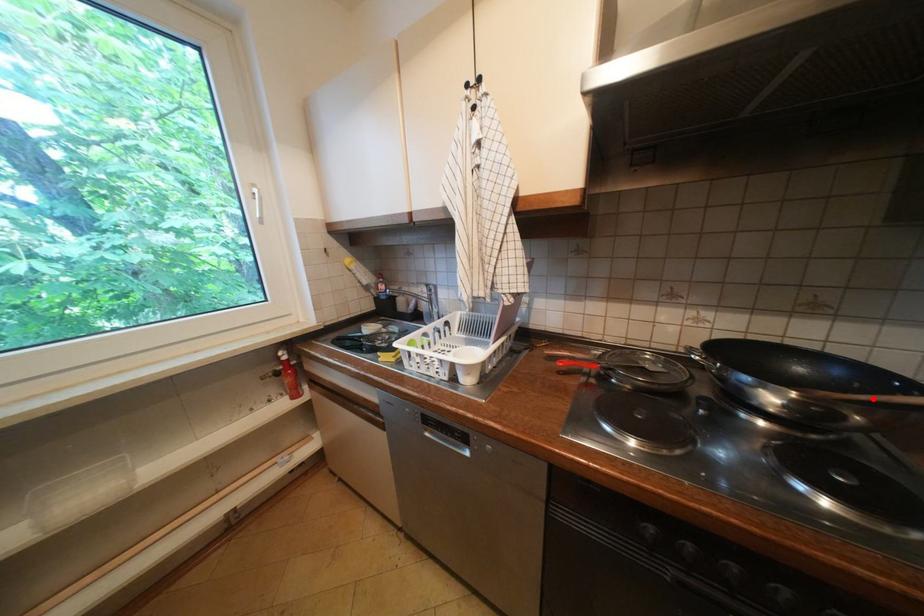
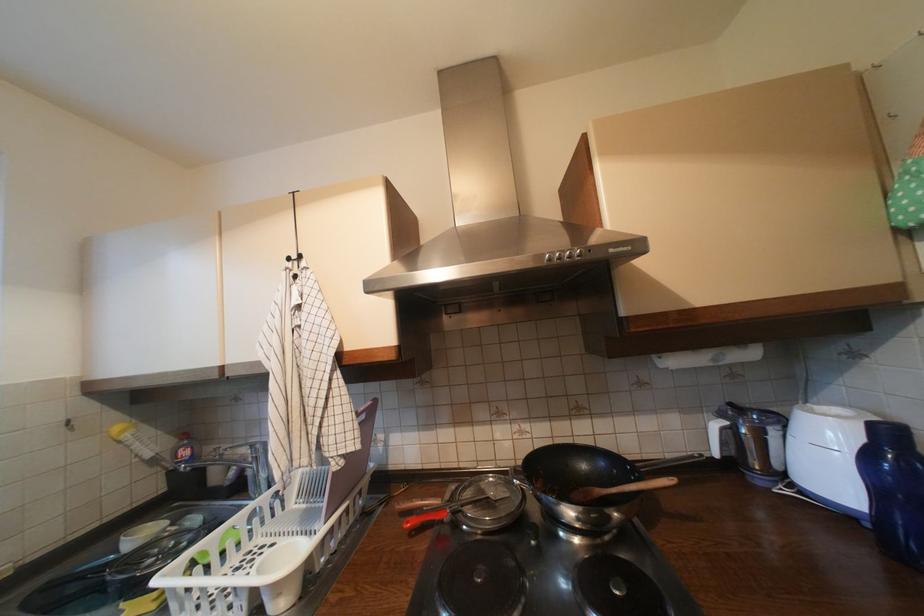
Locate, in the second image, the point that corresponds to the highlighted location in the first image.

(623, 492)